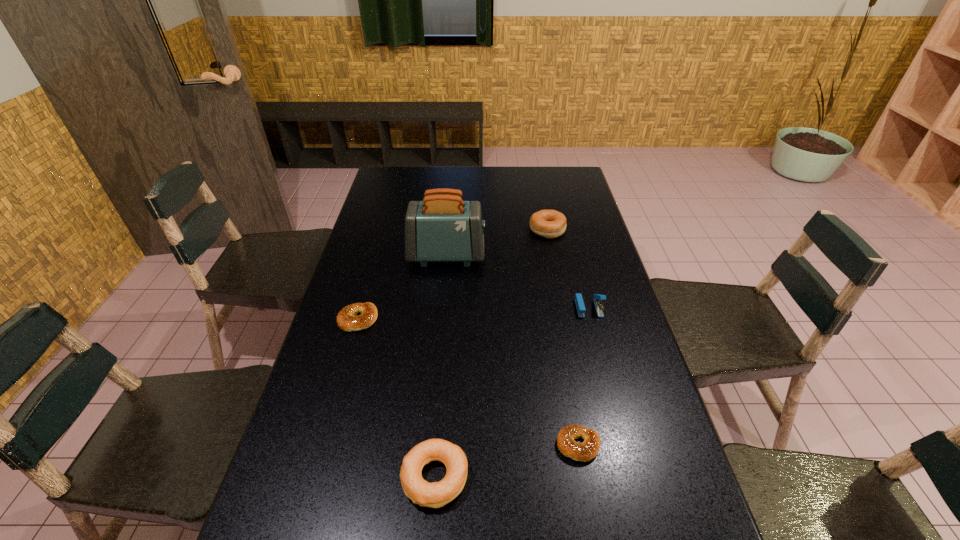
Where is `blank space located 0.150m on the front-facing side of the fifth nearest object`? This screenshot has width=960, height=540. blank space located 0.150m on the front-facing side of the fifth nearest object is located at coordinates (528, 255).

The width and height of the screenshot is (960, 540). I want to click on vacant space located on the front of the stapler, so point(594,330).

At what (x,y) coordinates should I click in order to perform the action: click on vacant space located on the right of the tallest bagel. Please return your answer as a coordinate pair (x, y). The width and height of the screenshot is (960, 540). Looking at the image, I should click on (x=579, y=230).

Find the location of a particular element. The width and height of the screenshot is (960, 540). vacant position located on the left of the second tallest bagel is located at coordinates (369, 477).

Locate an element on the screen. vacant space situated 0.200m on the back of the second shortest object is located at coordinates (373, 264).

Where is `blank space located on the right of the shortest bagel`? The width and height of the screenshot is (960, 540). blank space located on the right of the shortest bagel is located at coordinates (666, 445).

Where is `object that is at the left edge`? This screenshot has width=960, height=540. object that is at the left edge is located at coordinates (347, 319).

Image resolution: width=960 pixels, height=540 pixels. In order to click on stapler at the right edge in this screenshot , I will do `click(579, 302)`.

Where is `bagel that is at the right edge`? Image resolution: width=960 pixels, height=540 pixels. bagel that is at the right edge is located at coordinates (550, 224).

Find the location of `vacant space at the far edge of the desktop`. vacant space at the far edge of the desktop is located at coordinates (483, 177).